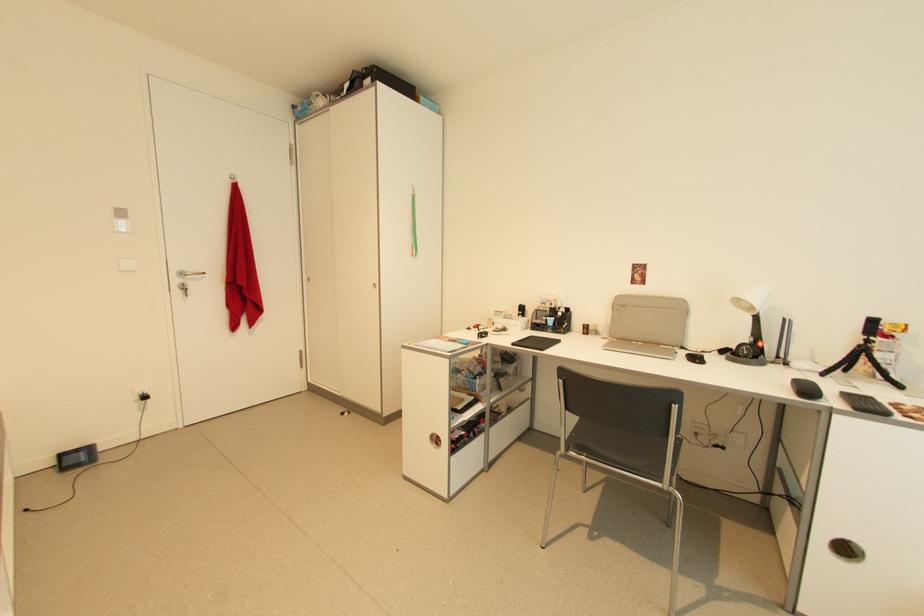
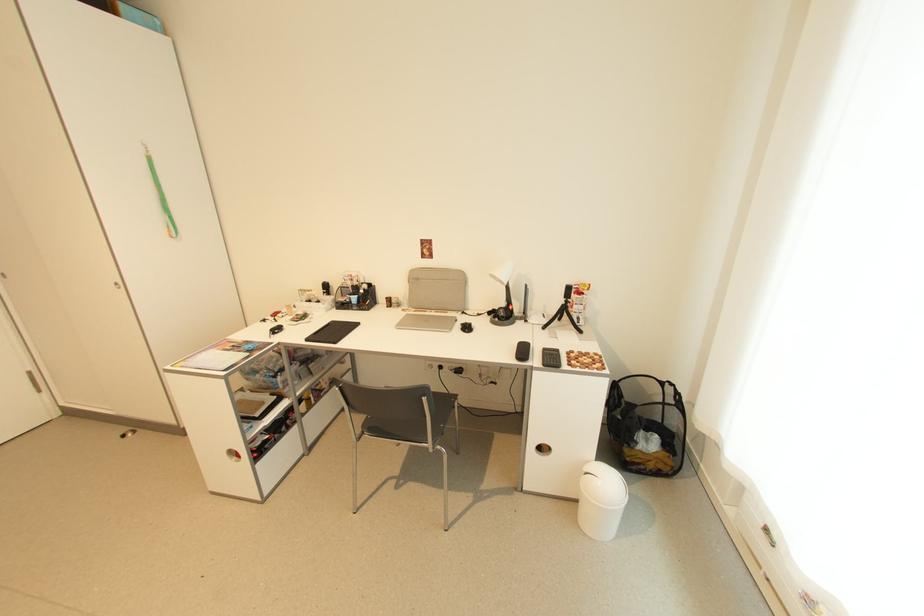
Find the pixel in the second image that matches (418,253) in the first image.

(175, 233)